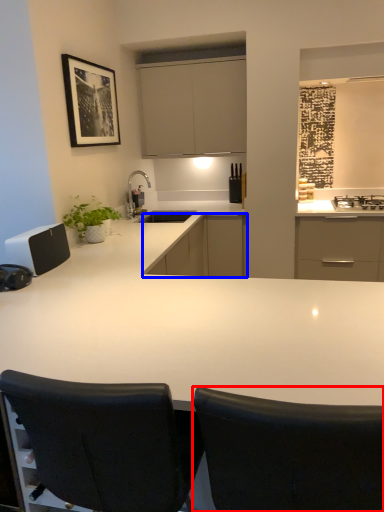
Question: Which object is closer to the camera taking this photo, chair (highlighted by a red box) or cabinetry (highlighted by a blue box)?

Choices:
 (A) chair
 (B) cabinetry

Answer: (A)